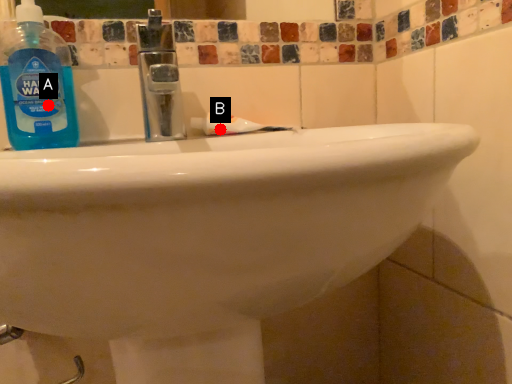
Question: Two points are circled on the image, labeled by A and B beside each circle. Among these points, which one is farthest from the camera?

Choices:
 (A) A is further
 (B) B is further

Answer: (B)